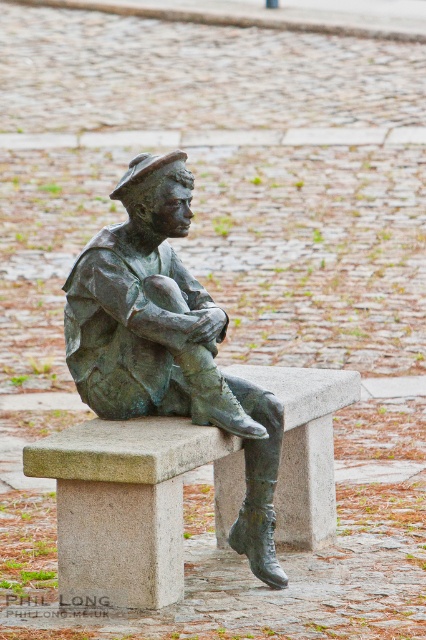
You are an artist planning to sketch the statue and the bench. Based on the scene, which object is taller between the granite bench at center and the bronze statue at center?

The bronze statue at center is taller than the granite bench at center according to the description.

You are standing in front of the bronze statue at center and want to sit down on the granite bench at center. Is the bench positioned in a way that allows you to sit directly in front of the statue?

The granite bench at center is in front of the bronze statue at center, so yes, you can sit directly in front of the statue on the bench.